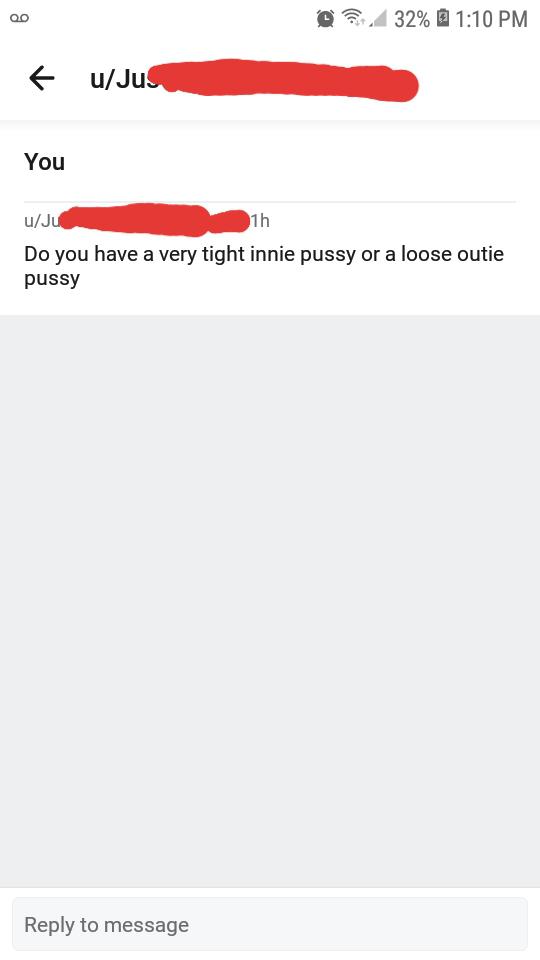
What are the coordinates of `alarm` in the screenshot? It's located at (327, 17).